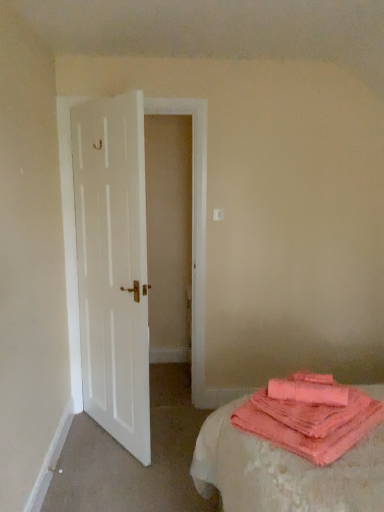
Question: Is coral terry cloth at lower right oriented away from white wooden door at left?

Choices:
 (A) no
 (B) yes

Answer: (A)

Question: Considering the relative sizes of coral terry cloth at lower right and white wooden door at left in the image provided, is coral terry cloth at lower right bigger than white wooden door at left?

Choices:
 (A) yes
 (B) no

Answer: (B)

Question: Is coral terry cloth at lower right positioned before white wooden door at left?

Choices:
 (A) no
 (B) yes

Answer: (B)

Question: Considering the relative positions of coral terry cloth at lower right and white wooden door at left in the image provided, is coral terry cloth at lower right to the right of white wooden door at left from the viewer's perspective?

Choices:
 (A) yes
 (B) no

Answer: (A)

Question: Is coral terry cloth at lower right further to the viewer compared to white wooden door at left?

Choices:
 (A) no
 (B) yes

Answer: (A)

Question: From the image's perspective, is coral terry cloth at lower right over white wooden door at left?

Choices:
 (A) yes
 (B) no

Answer: (B)

Question: Is the depth of coral terry cloth at lower right greater than that of coral soft towel at lower right?

Choices:
 (A) no
 (B) yes

Answer: (A)

Question: Considering the relative sizes of coral terry cloth at lower right and coral soft towel at lower right in the image provided, is coral terry cloth at lower right wider than coral soft towel at lower right?

Choices:
 (A) yes
 (B) no

Answer: (A)

Question: Is coral terry cloth at lower right located outside coral soft towel at lower right?

Choices:
 (A) no
 (B) yes

Answer: (B)

Question: Is coral terry cloth at lower right bigger than coral soft towel at lower right?

Choices:
 (A) no
 (B) yes

Answer: (B)

Question: Is coral soft towel at lower right at the back of coral terry cloth at lower right?

Choices:
 (A) no
 (B) yes

Answer: (A)

Question: Considering the relative positions of coral terry cloth at lower right and coral soft towel at lower right in the image provided, is coral terry cloth at lower right to the right of coral soft towel at lower right from the viewer's perspective?

Choices:
 (A) yes
 (B) no

Answer: (A)

Question: Is coral soft towel at lower right at the right side of coral terry cloth at lower right?

Choices:
 (A) yes
 (B) no

Answer: (B)